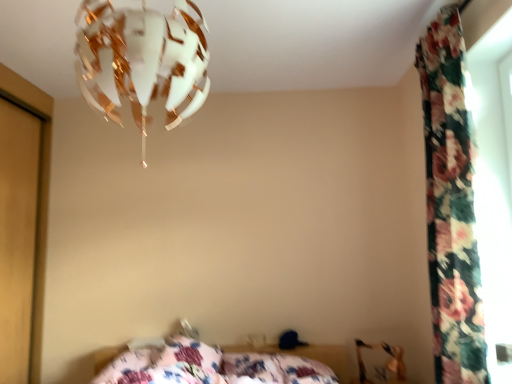
Question: From a real-world perspective, is metallic gold swivel chair at lower right positioned over white matte lampshade at upper center based on gravity?

Choices:
 (A) yes
 (B) no

Answer: (B)

Question: Is metallic gold swivel chair at lower right placed right next to white matte lampshade at upper center?

Choices:
 (A) yes
 (B) no

Answer: (B)

Question: Is metallic gold swivel chair at lower right in front of white matte lampshade at upper center?

Choices:
 (A) yes
 (B) no

Answer: (B)

Question: From the image's perspective, does metallic gold swivel chair at lower right appear lower than white matte lampshade at upper center?

Choices:
 (A) yes
 (B) no

Answer: (A)

Question: Would you say white matte lampshade at upper center is part of metallic gold swivel chair at lower right's contents?

Choices:
 (A) yes
 (B) no

Answer: (B)

Question: Considering the positions of floral fabric pillow at lower center, marked as the 2th pillow in a right-to-left arrangement, and white matte lampshade at upper center in the image, is floral fabric pillow at lower center, marked as the 2th pillow in a right-to-left arrangement, taller or shorter than white matte lampshade at upper center?

Choices:
 (A) tall
 (B) short

Answer: (B)

Question: Considering the positions of floral fabric pillow at lower center, marked as the 2th pillow in a right-to-left arrangement, and white matte lampshade at upper center in the image, is floral fabric pillow at lower center, marked as the 2th pillow in a right-to-left arrangement, wider or thinner than white matte lampshade at upper center?

Choices:
 (A) thin
 (B) wide

Answer: (A)

Question: From a real-world perspective, relative to white matte lampshade at upper center, is floral fabric pillow at lower center, marked as the 2th pillow in a right-to-left arrangement, vertically above or below?

Choices:
 (A) above
 (B) below

Answer: (B)

Question: From the image's perspective, is floral fabric pillow at lower center, marked as the 2th pillow in a right-to-left arrangement, positioned above or below white matte lampshade at upper center?

Choices:
 (A) above
 (B) below

Answer: (B)

Question: In terms of width, does floral fabric pillow at lower center, which appears as the first pillow when viewed from the left, look wider or thinner when compared to floral fabric curtain at right?

Choices:
 (A) thin
 (B) wide

Answer: (B)

Question: From the image's perspective, is floral fabric pillow at lower center, which appears as the first pillow when viewed from the left, positioned above or below floral fabric curtain at right?

Choices:
 (A) below
 (B) above

Answer: (A)

Question: Is floral fabric pillow at lower center, marked as the 2th pillow in a right-to-left arrangement, taller or shorter than floral fabric curtain at right?

Choices:
 (A) tall
 (B) short

Answer: (B)

Question: Is floral fabric pillow at lower center, which appears as the first pillow when viewed from the left, inside the boundaries of floral fabric curtain at right, or outside?

Choices:
 (A) outside
 (B) inside

Answer: (A)

Question: Is point (385, 347) closer or farther from the camera than point (457, 190)?

Choices:
 (A) farther
 (B) closer

Answer: (A)

Question: Would you say metallic gold swivel chair at lower right is inside or outside floral fabric curtain at right?

Choices:
 (A) outside
 (B) inside

Answer: (A)